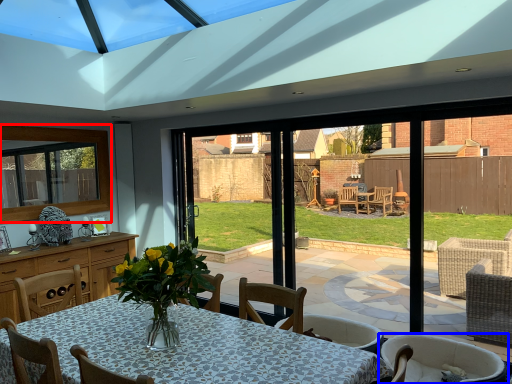
Question: Which object is further to the camera taking this photo, window (highlighted by a red box) or chair (highlighted by a blue box)?

Choices:
 (A) window
 (B) chair

Answer: (A)